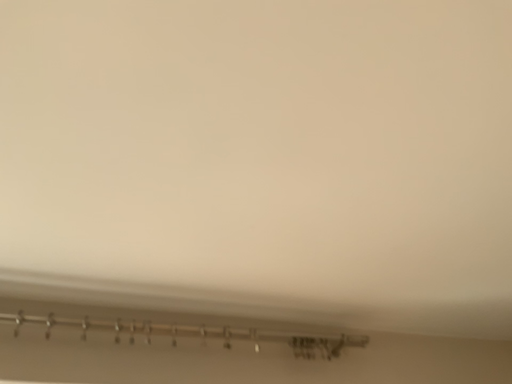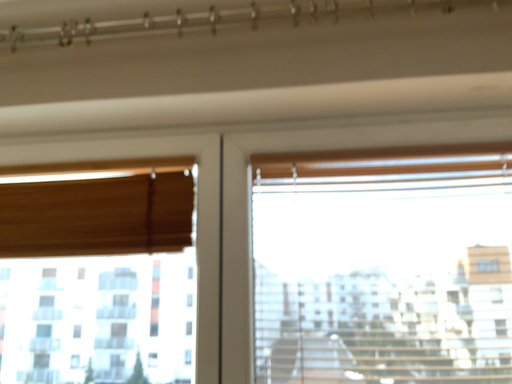
Question: How did the camera likely rotate when shooting the video?

Choices:
 (A) rotated left
 (B) rotated right

Answer: (A)